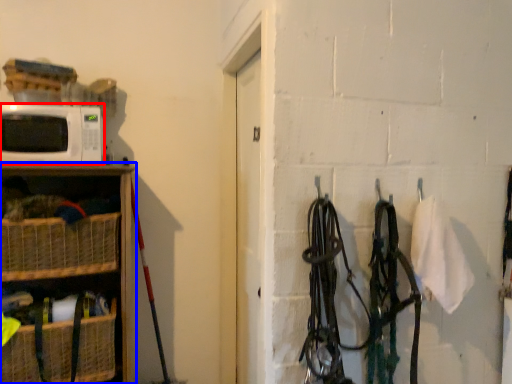
Question: Which of the following is the closest to the observer, microwave oven (highlighted by a red box) or shelf (highlighted by a blue box)?

Choices:
 (A) microwave oven
 (B) shelf

Answer: (B)